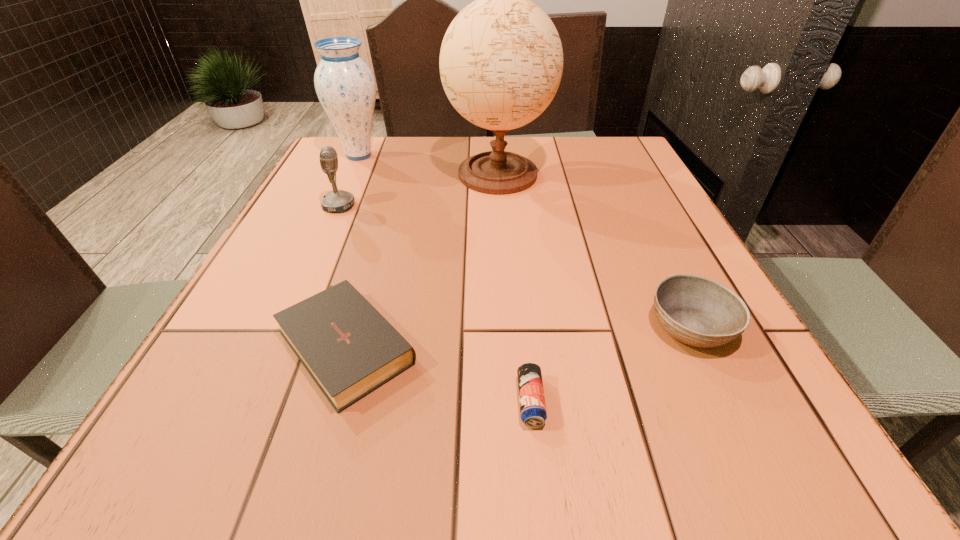
You are a GUI agent. You are given a task and a screenshot of the screen. Output one action in this format:
    pyautogui.click(x=<x>, y=<y>)
    Task: Click on the vacant space located on the back of the bowl
    The height and width of the screenshot is (540, 960).
    Given the screenshot: What is the action you would take?
    pyautogui.click(x=667, y=277)

Where is `vacant space situated on the back of the Bible`? The image size is (960, 540). vacant space situated on the back of the Bible is located at coordinates (377, 240).

The image size is (960, 540). I want to click on vacant space situated on the back of the shortest object, so click(x=524, y=333).

The height and width of the screenshot is (540, 960). Find the location of `globe present at the far edge`. globe present at the far edge is located at coordinates tap(501, 60).

Identify the location of vase at the far edge. (345, 85).

Find the location of `object that is at the near edge`. object that is at the near edge is located at coordinates (533, 413).

Where is `vase that is at the left edge`? vase that is at the left edge is located at coordinates (345, 85).

Locate an element on the screen. This screenshot has height=540, width=960. microphone present at the left edge is located at coordinates (338, 201).

I want to click on Bible that is at the left edge, so click(x=349, y=349).

Where is `object located at the right edge`? The image size is (960, 540). object located at the right edge is located at coordinates (698, 311).